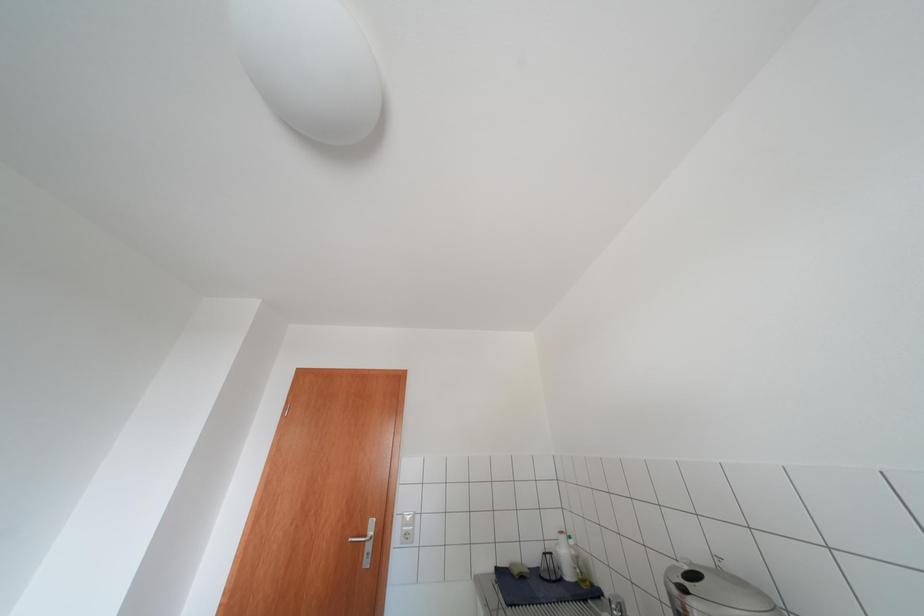
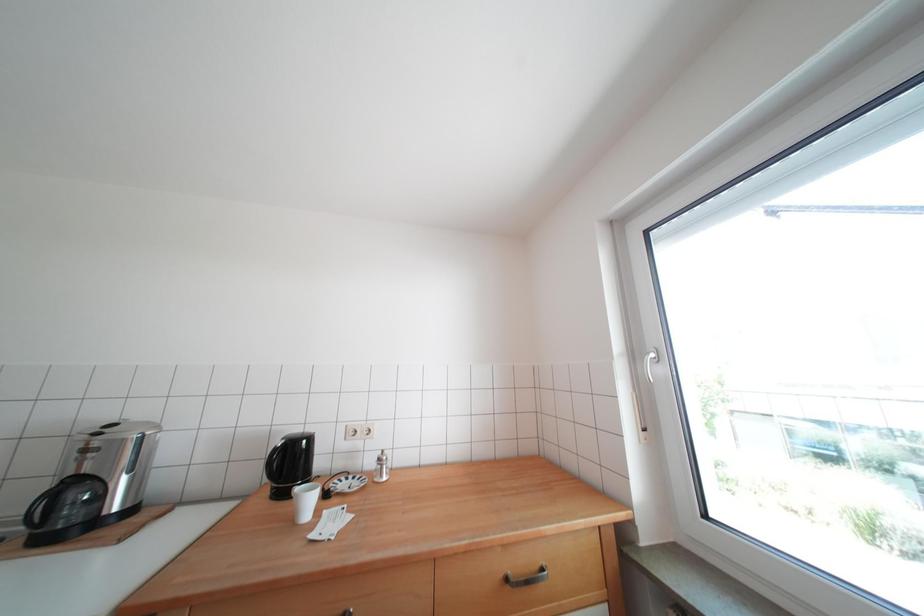
Based on the continuous images, in which direction is the camera rotating?

The camera's rotation is toward right-up.